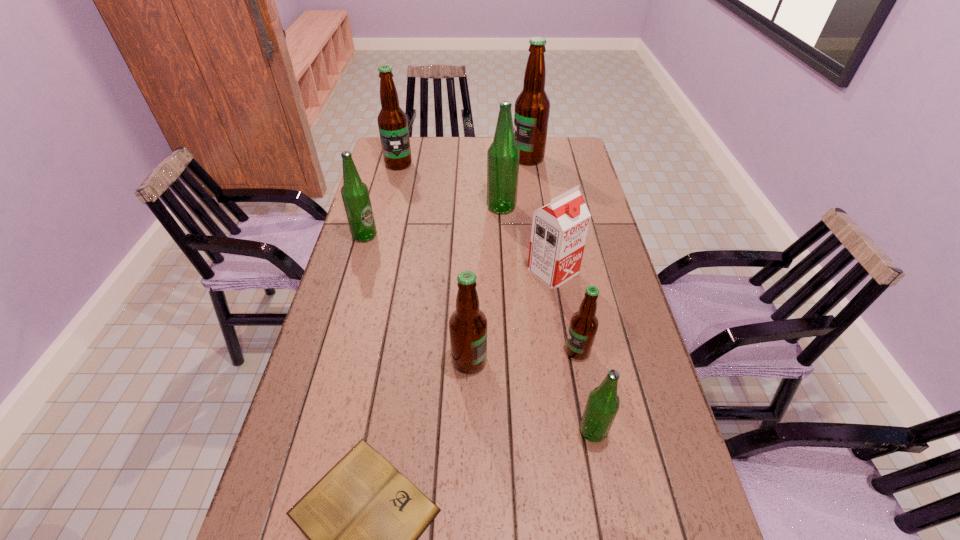
Locate an element on the screen. This screenshot has width=960, height=540. vacant space in between the third beer bottle from left to right and the leftmost green beer bottle is located at coordinates (417, 299).

The image size is (960, 540). Identify the location of free space between the second smallest brown beer bottle and the leftmost brown beer bottle. (434, 262).

Where is `object that stands as the seventh closest to the book`? The image size is (960, 540). object that stands as the seventh closest to the book is located at coordinates (392, 121).

Select which object is the fifth closest to the second biggest brown beer bottle. Please provide its 2D coordinates. Your answer should be formatted as a tuple, i.e. [(x, y)], where the tuple contains the x and y coordinates of a point satisfying the conditions above.

[(468, 324)]

Identify which beer bottle is the third nearest to the soya milk. Please provide its 2D coordinates. Your answer should be formatted as a tuple, i.e. [(x, y)], where the tuple contains the x and y coordinates of a point satisfying the conditions above.

[(468, 324)]

Locate an element on the screen. This screenshot has height=540, width=960. the fifth closest beer bottle to the rightmost green beer bottle is located at coordinates (532, 107).

At what (x,y) coordinates should I click in order to perform the action: click on brown beer bottle that is the second closest to the book. Please return your answer as a coordinate pair (x, y). This screenshot has width=960, height=540. Looking at the image, I should click on (583, 326).

Find the location of a particular element. the third closest brown beer bottle to the second nearest green beer bottle is located at coordinates (532, 107).

You are a GUI agent. You are given a task and a screenshot of the screen. Output one action in this format:
    pyautogui.click(x=<x>, y=<y>)
    Task: Click on the green beer bottle that stands as the third closest to the second brown beer bottle from left to right
    
    Given the screenshot: What is the action you would take?
    pyautogui.click(x=503, y=155)

Select which green beer bottle is the closest to the rightmost green beer bottle. Please provide its 2D coordinates. Your answer should be formatted as a tuple, i.e. [(x, y)], where the tuple contains the x and y coordinates of a point satisfying the conditions above.

[(503, 155)]